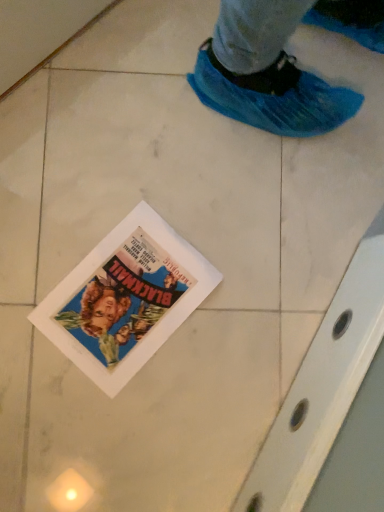
Measure the distance between white paper at center and camera.

white paper at center is 29.53 inches from camera.

Identify the location of white paper at center. The height and width of the screenshot is (512, 384). (125, 298).

The width and height of the screenshot is (384, 512). Describe the element at coordinates (125, 298) in the screenshot. I see `white paper at center` at that location.

You are a GUI agent. You are given a task and a screenshot of the screen. Output one action in this format:
    pyautogui.click(x=<x>, y=<y>)
    Task: Click on the white paper at center
    This screenshot has height=512, width=384.
    Given the screenshot: What is the action you would take?
    pyautogui.click(x=125, y=298)